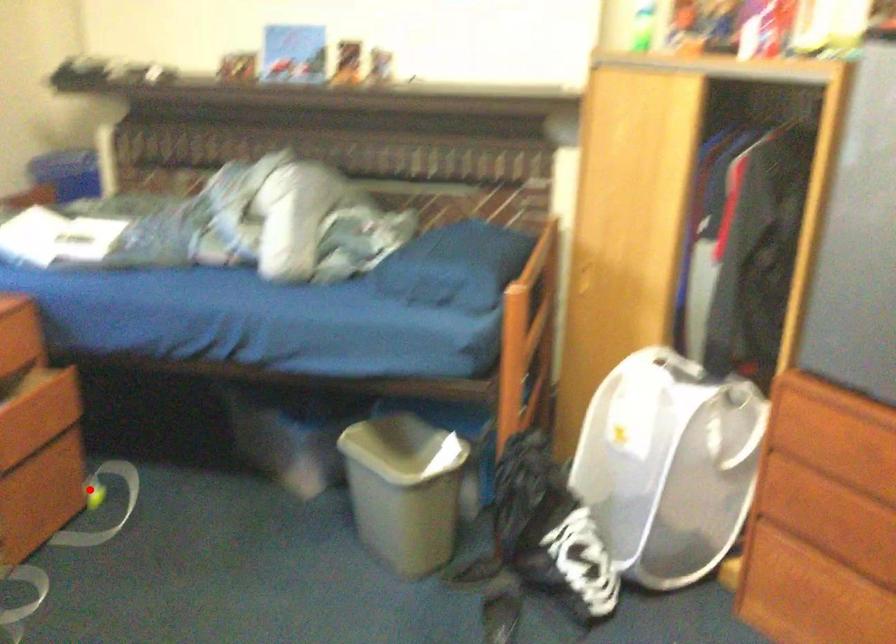
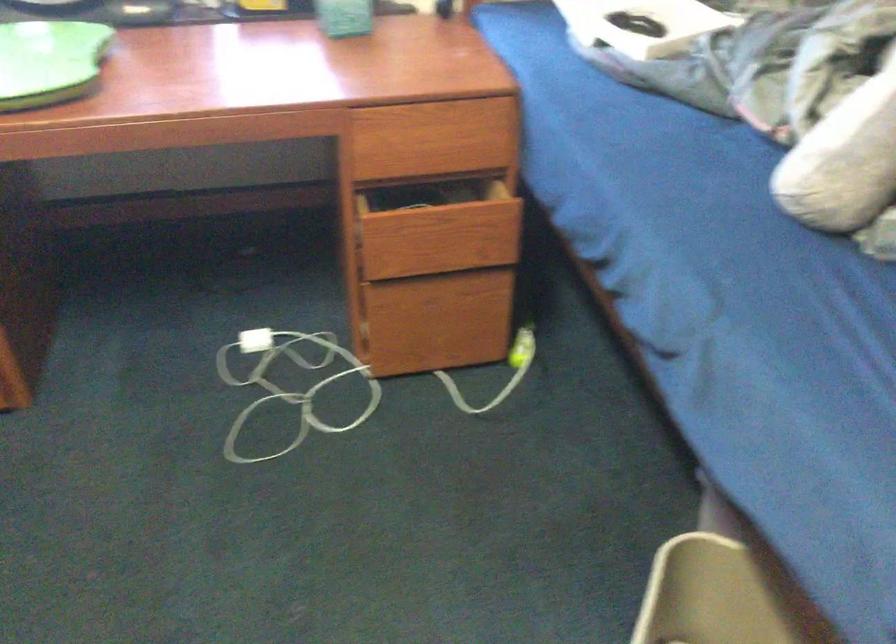
Question: I am providing you with two images of the same scene from different viewpoints. A red point is shown in image1. For the corresponding object point in image2, is it positioned nearer or farther from the camera?

Choices:
 (A) Nearer
 (B) Farther

Answer: (A)